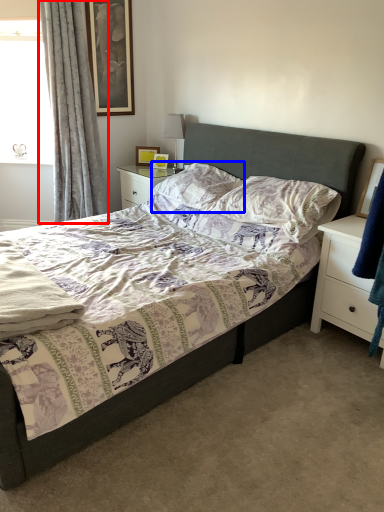
Question: Among these objects, which one is farthest to the camera, curtain (highlighted by a red box) or pillow (highlighted by a blue box)?

Choices:
 (A) curtain
 (B) pillow

Answer: (A)